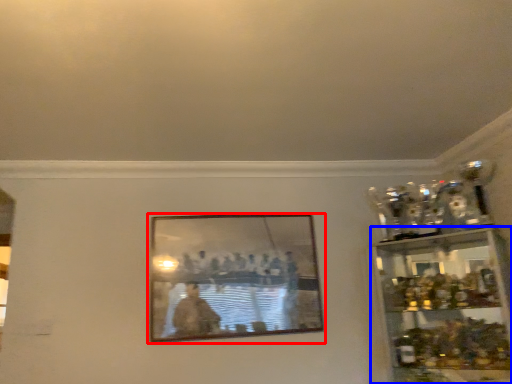
Question: Which object is further to the camera taking this photo, picture frame (highlighted by a red box) or shelf (highlighted by a blue box)?

Choices:
 (A) picture frame
 (B) shelf

Answer: (A)